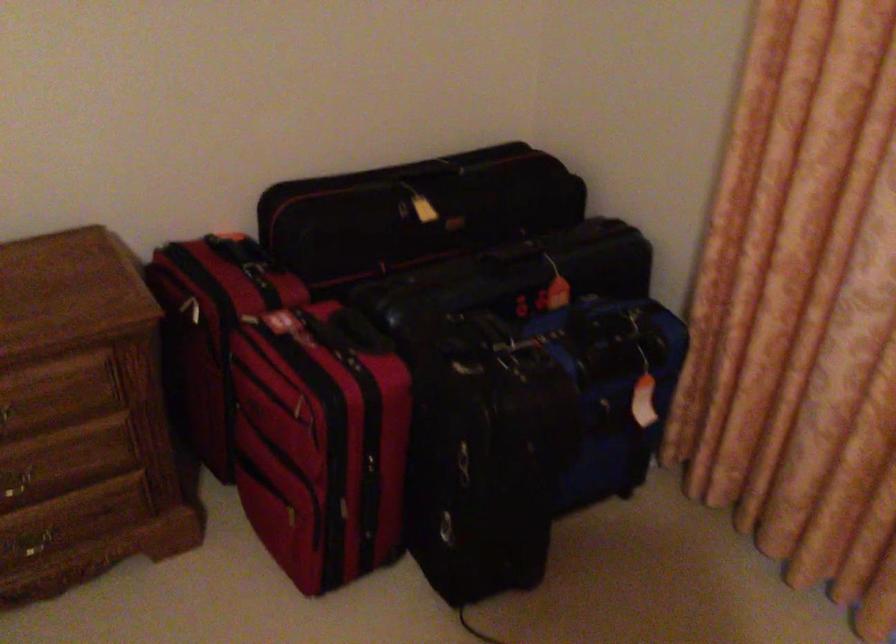
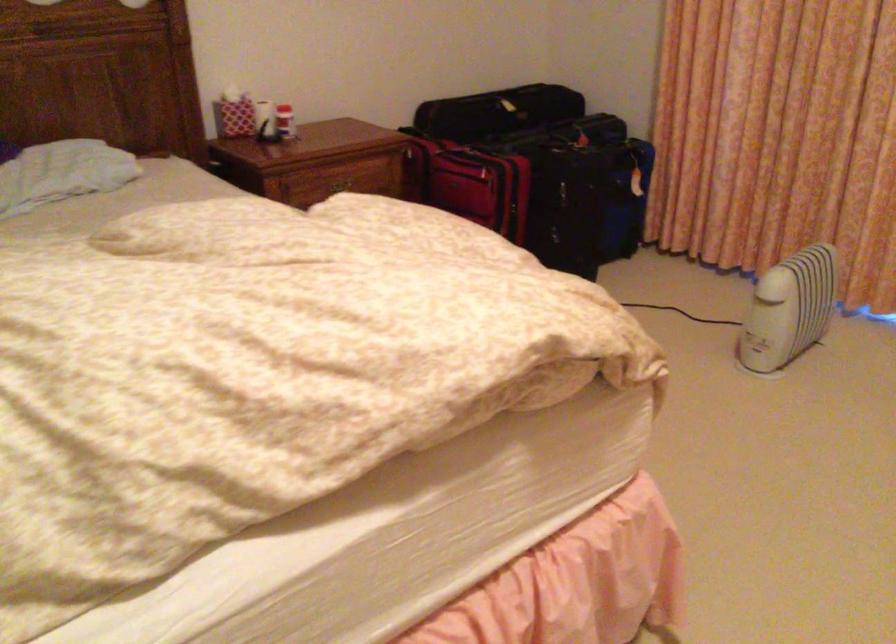
Find the pixel in the second image that matches pixel 295 402 in the first image.

(469, 183)